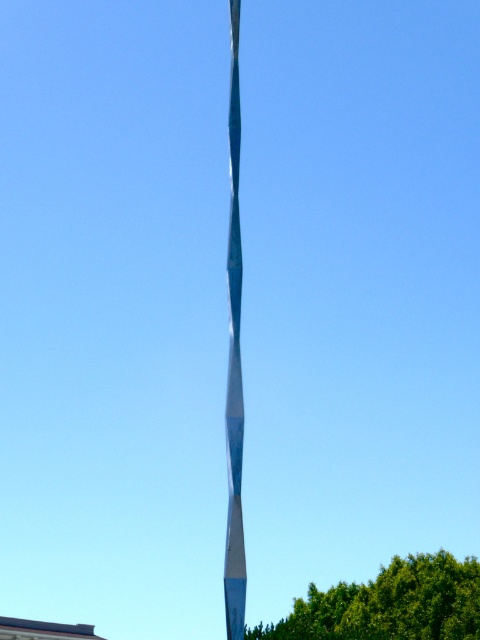
Can you confirm if green leafy tree at lower center is taller than shiny blue pole at center?

In fact, green leafy tree at lower center may be shorter than shiny blue pole at center.

Is green leafy tree at lower center above shiny blue pole at center?

No.

Between point (469, 593) and point (238, 333), which one is positioned in front?

Point (238, 333) is more forward.

Locate an element on the screen. The height and width of the screenshot is (640, 480). green leafy tree at lower center is located at coordinates (389, 604).